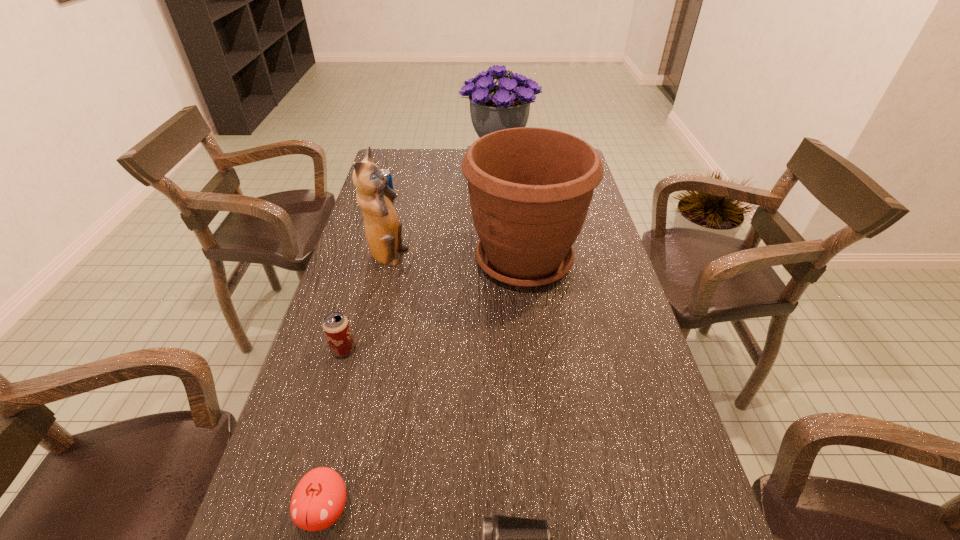
Find the location of a particular element. object that is positioned at the far edge is located at coordinates [x=493, y=107].

The height and width of the screenshot is (540, 960). In order to click on cat positioned at the left edge in this screenshot , I will do `click(383, 229)`.

Where is `pop soda that is at the left edge`? The height and width of the screenshot is (540, 960). pop soda that is at the left edge is located at coordinates (386, 172).

You are a GUI agent. You are given a task and a screenshot of the screen. Output one action in this format:
    pyautogui.click(x=<x>, y=<y>)
    Task: Click on the beer can located at the left edge
    The image size is (960, 540).
    Given the screenshot: What is the action you would take?
    pyautogui.click(x=336, y=327)

Image resolution: width=960 pixels, height=540 pixels. In order to click on object located at the right edge in this screenshot , I will do `click(530, 189)`.

The height and width of the screenshot is (540, 960). I want to click on free space at the far edge, so click(x=444, y=150).

Identify the location of vacant space at the left edge of the desktop. (370, 395).

The height and width of the screenshot is (540, 960). In the image, there is a desktop. What are the coordinates of `vacant space at the right edge` in the screenshot? It's located at (607, 452).

The height and width of the screenshot is (540, 960). I want to click on blank region between the farthest object and the sixth nearest object, so click(x=443, y=183).

The height and width of the screenshot is (540, 960). Identify the location of empty space that is in between the flowerpot and the third nearest object. (434, 305).